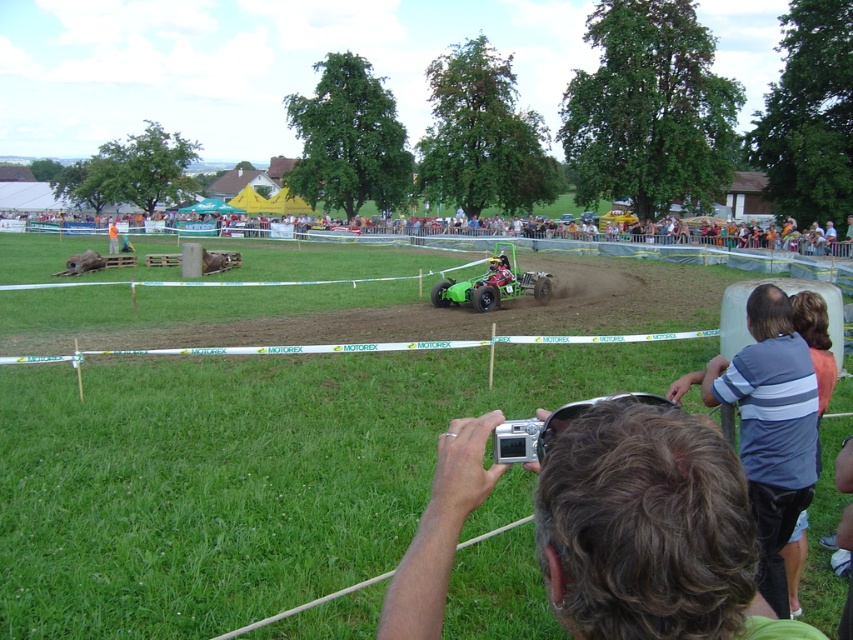
You are a photographer positioned at the camera in the scene. You want to capture the green rubber car at center. Based on the coordinates provided, is the car positioned to the left or right of the center point of the image?

The green rubber car at center is positioned at coordinates point (247, 474), which places it to the right of the center point of the image.

You are a photographer standing at the event and need to adjust your camera focus. Which object, the gray hair at lower center or the green plastic chairs at upper center, is closer to you?

The gray hair at lower center is closer to the viewer than the green plastic chairs at upper center, so you should focus on the gray hair at lower center.